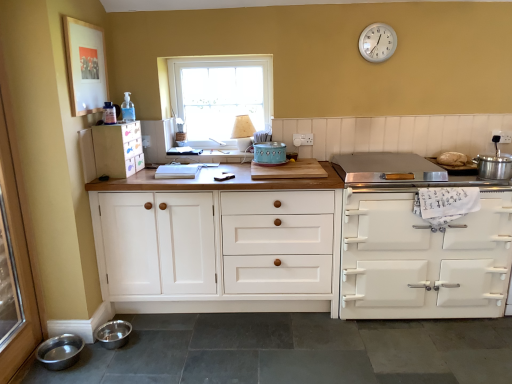
Identify the location of blank area beneath stainless steel bowl at lower left, placed as the 1th bowl when sorted from left to right (from a real-world perspective). The height and width of the screenshot is (384, 512). (68, 357).